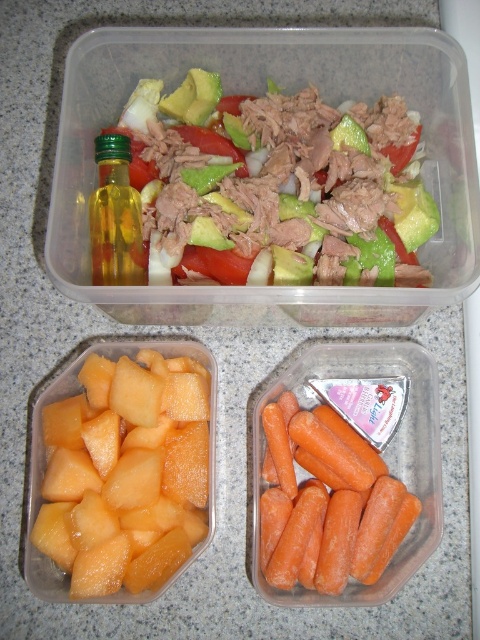
Can you confirm if shiny green avocado at upper center is positioned to the right of green glass bottle at upper left?

Indeed, shiny green avocado at upper center is positioned on the right side of green glass bottle at upper left.

Which of these two, shiny green avocado at upper center or green glass bottle at upper left, stands shorter?

With less height is green glass bottle at upper left.

The height and width of the screenshot is (640, 480). What are the coordinates of `shiny green avocado at upper center` in the screenshot? It's located at (260, 189).

Does yellow matte melon at lower left appear on the right side of orange smooth carrot at lower right?

In fact, yellow matte melon at lower left is to the left of orange smooth carrot at lower right.

Is point (57, 460) farther from camera compared to point (292, 520)?

Yes, it is behind point (292, 520).

This screenshot has width=480, height=640. Identify the location of yellow matte melon at lower left. (126, 474).

Does point (280, 544) lie behind point (131, 284)?

No, (280, 544) is in front of (131, 284).

Does orange smooth carrot at lower right appear on the right side of green glass bottle at upper left?

Correct, you'll find orange smooth carrot at lower right to the right of green glass bottle at upper left.

This screenshot has width=480, height=640. What do you see at coordinates (327, 504) in the screenshot?
I see `orange smooth carrot at lower right` at bounding box center [327, 504].

Locate an element on the screen. orange smooth carrot at lower right is located at coordinates (327, 504).